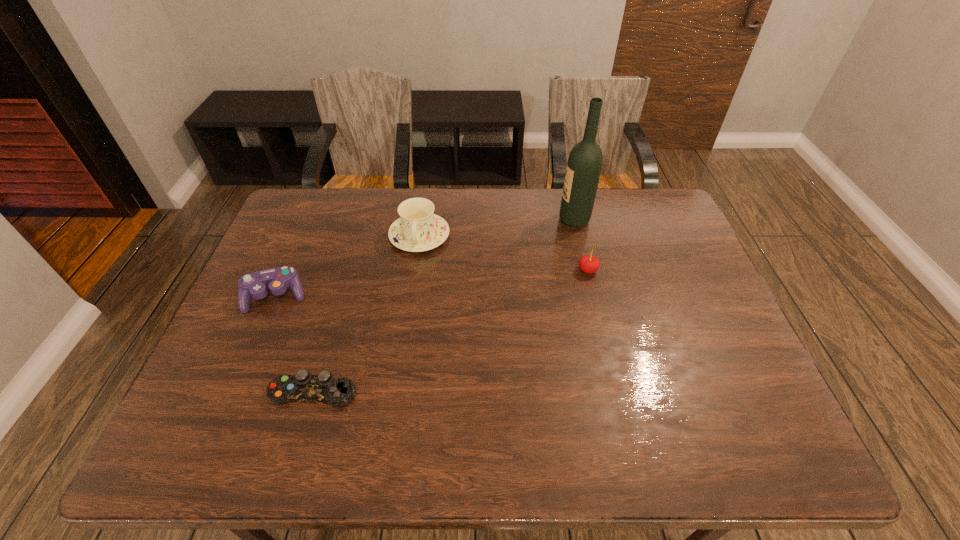
The height and width of the screenshot is (540, 960). I want to click on free space located 0.110m on the handle side of the chinaware, so click(413, 283).

Where is `free space located on the left of the third farthest object`? free space located on the left of the third farthest object is located at coordinates (482, 271).

Identify the location of vacant region located 0.090m on the right of the second shortest object. (339, 296).

I want to click on vacant space situated 0.160m on the right of the nearest object, so click(x=427, y=393).

The width and height of the screenshot is (960, 540). I want to click on wine bottle positioned at the far edge, so point(584,165).

Locate an element on the screen. The height and width of the screenshot is (540, 960). chinaware present at the far edge is located at coordinates (418, 229).

Where is `object located at the left edge`? object located at the left edge is located at coordinates (277, 280).

Identify the location of vacant space at the far edge of the desktop. (620, 215).

Find the location of a particular element. The height and width of the screenshot is (540, 960). free space at the left edge of the desktop is located at coordinates click(284, 235).

Where is `vacant space at the right edge`? Image resolution: width=960 pixels, height=540 pixels. vacant space at the right edge is located at coordinates (662, 235).